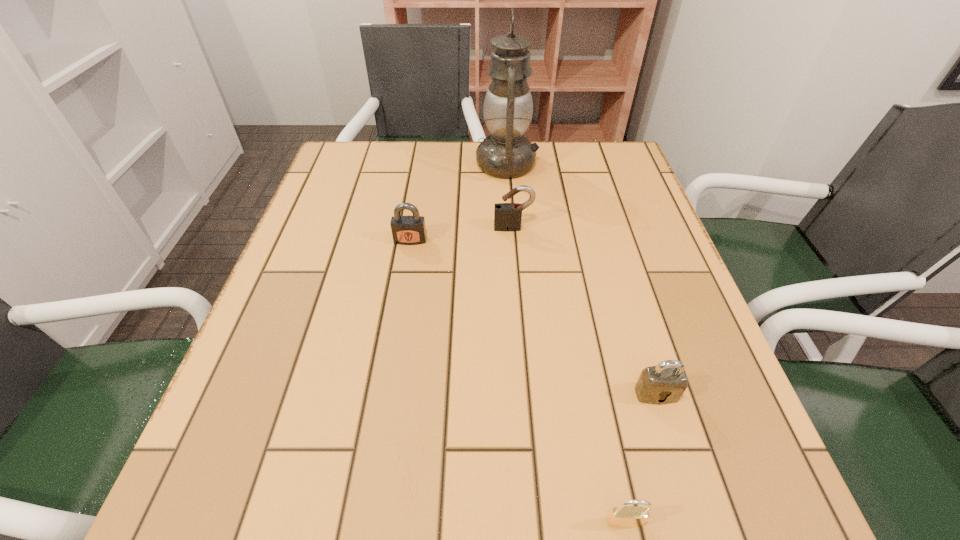
Image resolution: width=960 pixels, height=540 pixels. I want to click on free spot at the far left corner of the desktop, so click(348, 145).

In order to click on vacant space at the far right corner in this screenshot , I will do click(623, 156).

This screenshot has height=540, width=960. In order to click on empty space between the farthest object and the third padlock from left to right in this screenshot , I will do `click(565, 343)`.

Locate an element on the screen. This screenshot has width=960, height=540. vacant area between the leftmost padlock and the second nearest padlock is located at coordinates (533, 317).

Identify the location of blank region between the second farthest object and the leftmost padlock. (462, 234).

Identify the location of free spot between the second nearest padlock and the oil lamp. (582, 279).

Locate an element on the screen. The height and width of the screenshot is (540, 960). empty space that is in between the second padlock from left to right and the nearest padlock is located at coordinates (569, 375).

Locate an element on the screen. This screenshot has height=540, width=960. free area in between the nearest object and the oil lamp is located at coordinates (565, 343).

Find the location of `free space between the second farthest padlock and the shortest padlock`. free space between the second farthest padlock and the shortest padlock is located at coordinates (517, 381).

Locate an element on the screen. The height and width of the screenshot is (540, 960). vacant region between the shortest object and the farthest padlock is located at coordinates (569, 375).